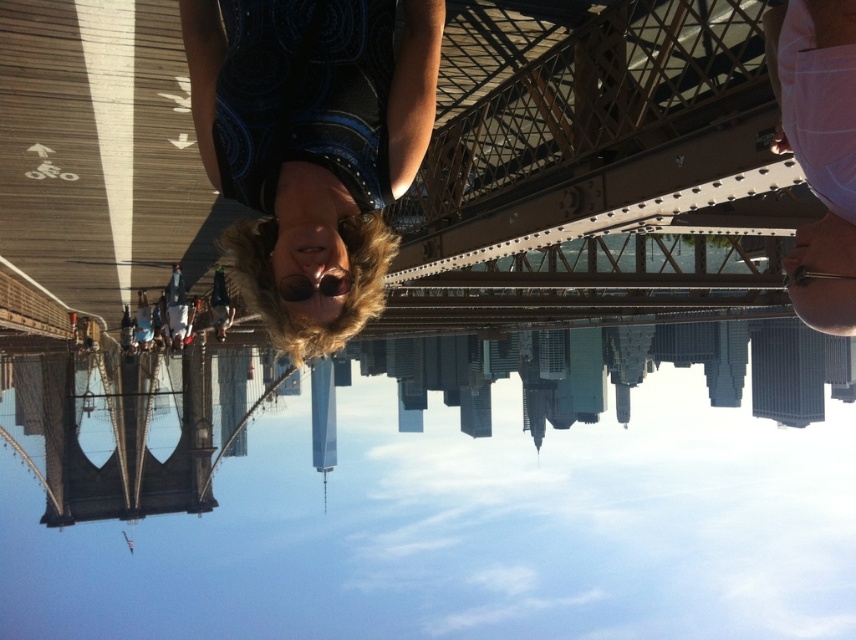
Question: Does metal bridge at center appear on the left side of dark blue printed dress at center?

Choices:
 (A) no
 (B) yes

Answer: (B)

Question: Among these objects, which one is nearest to the camera?

Choices:
 (A) dark blue printed dress at center
 (B) transparent glass water at center
 (C) metal bridge at center

Answer: (C)

Question: Can you confirm if transparent glass water at center is positioned above metal bridge at center?

Choices:
 (A) yes
 (B) no

Answer: (B)

Question: Based on their relative distances, which object is farther from the transparent glass water at center?

Choices:
 (A) metal bridge at center
 (B) dark blue printed dress at center

Answer: (A)

Question: Where is transparent glass water at center located in relation to dark blue printed dress at center in the image?

Choices:
 (A) left
 (B) right

Answer: (B)

Question: Which object is positioned farthest from the dark blue printed dress at center?

Choices:
 (A) transparent glass water at center
 (B) metal bridge at center

Answer: (A)